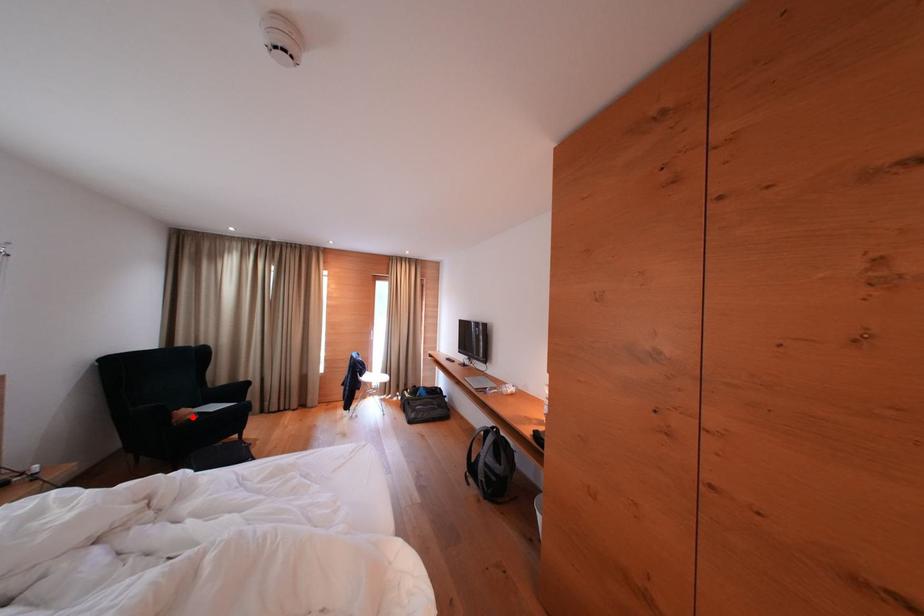
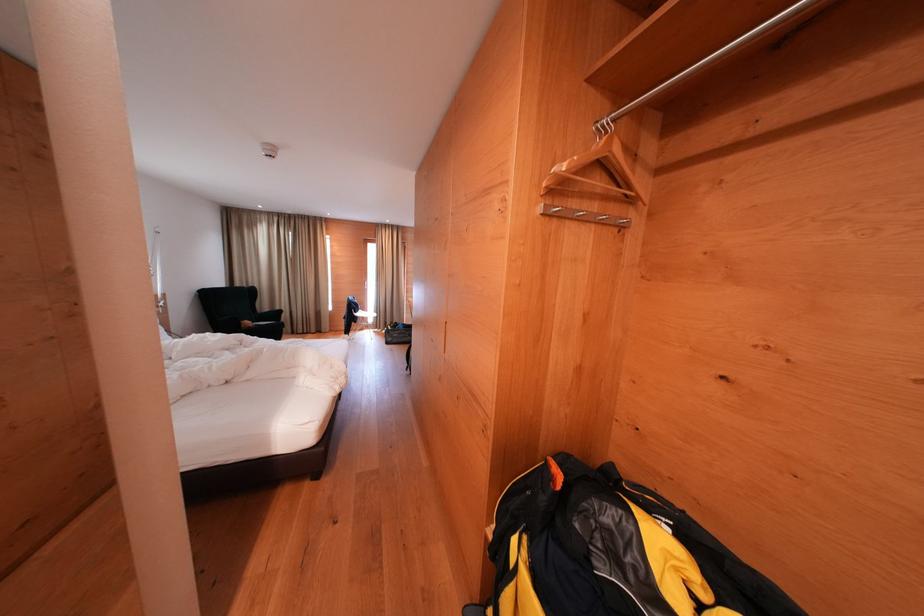
Where in the second image is the point corresponding to the highlighted location from the first image?

(254, 328)